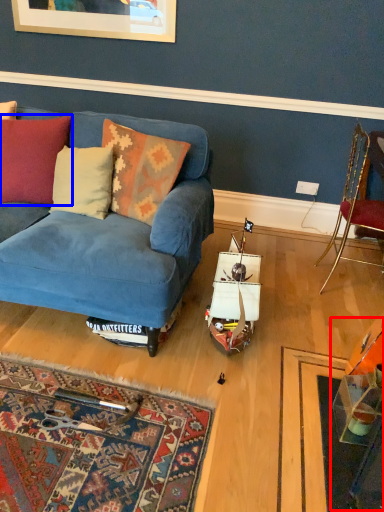
Question: Which of the following is the farthest to the observer, table (highlighted by a red box) or cushion (highlighted by a blue box)?

Choices:
 (A) table
 (B) cushion

Answer: (B)